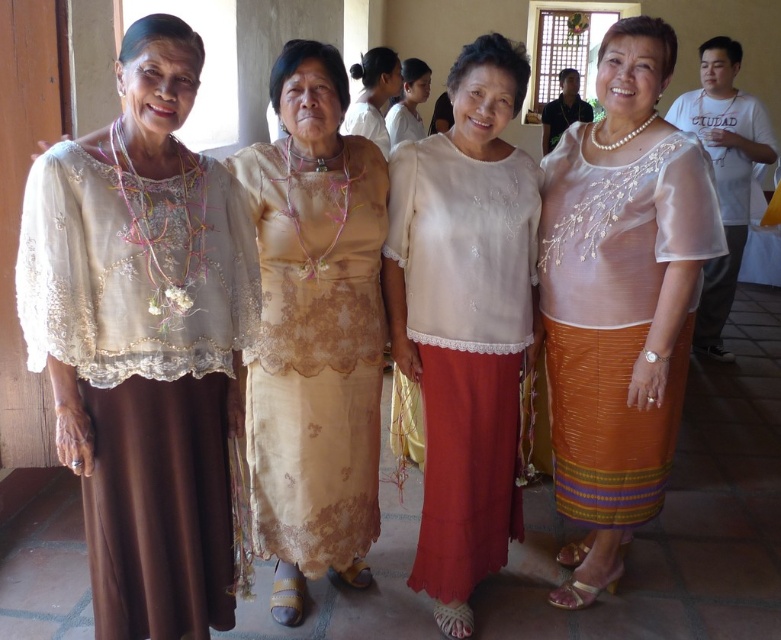
How distant is light beige lace blouse at center from white sheer blouse at upper center?

25.88 centimeters

The width and height of the screenshot is (781, 640). What do you see at coordinates (373, 96) in the screenshot? I see `light beige lace blouse at center` at bounding box center [373, 96].

Does point (357, 120) come behind point (409, 84)?

No.

Find the location of a particular element. light beige lace blouse at center is located at coordinates (373, 96).

Is point (639, 310) less distant than point (480, 538)?

Yes, it is in front of point (480, 538).

Locate an element on the screen. This screenshot has height=640, width=781. satin beige blouse at center is located at coordinates (619, 300).

I want to click on satin beige blouse at center, so click(x=619, y=300).

Can you confirm if matte brown dress at left is positioned to the right of satin beige blouse at center?

No, matte brown dress at left is not to the right of satin beige blouse at center.

Is matte brown dress at left positioned before satin beige blouse at center?

Yes, matte brown dress at left is in front of satin beige blouse at center.

Identify the location of matte brown dress at left. The height and width of the screenshot is (640, 781). (144, 371).

This screenshot has height=640, width=781. Identify the location of matte brown dress at left. (144, 371).